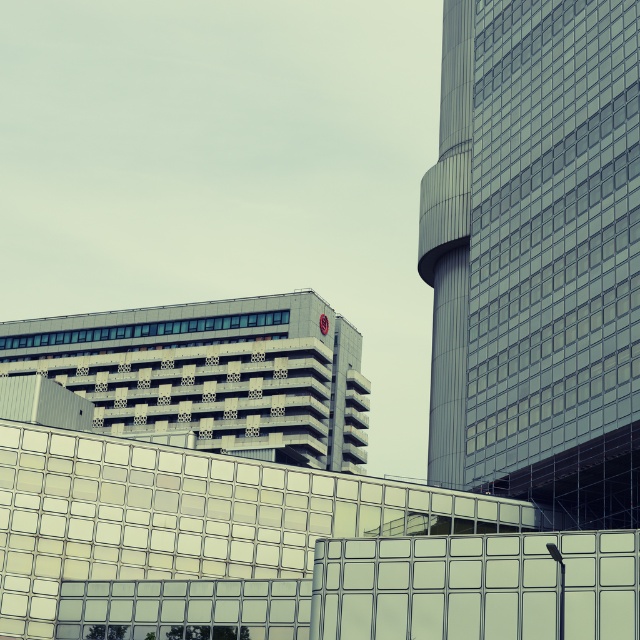
You are a city planner reviewing the urban layout. You notice the glassy steel tower at right and the gray concrete building at upper left. Which of these two structures is closer to the observer in this scene?

The glassy steel tower at right is closer to the observer because it is positioned in front of the gray concrete building at upper left.

You are a city planner evaluating the skyline. You need to determine if the glassy steel tower at right will block sunlight to the gray concrete building at upper left. Based on their heights, what can you conclude?

The glassy steel tower at right is taller than the gray concrete building at upper left, so it could potentially block sunlight depending on their positions and the angle of the sun.